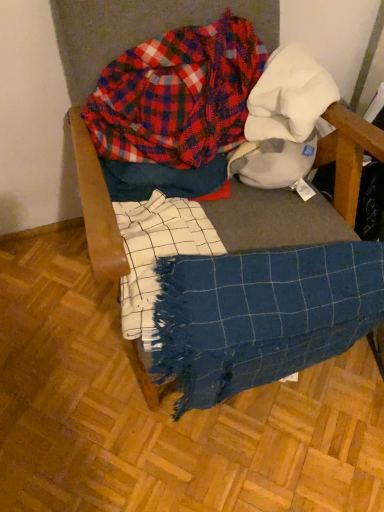
Where is `free space in front of blue woven blanket at center`? free space in front of blue woven blanket at center is located at coordinates (187, 453).